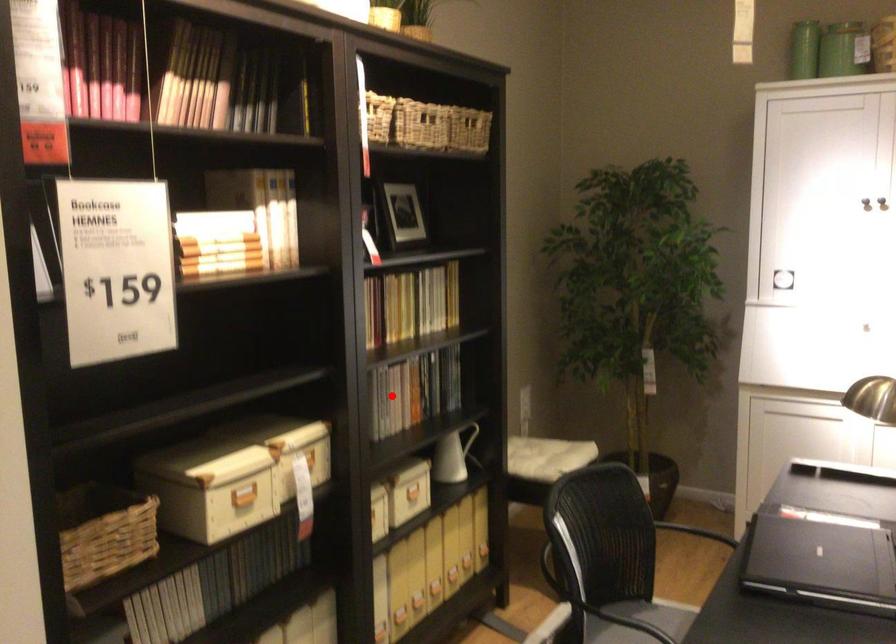
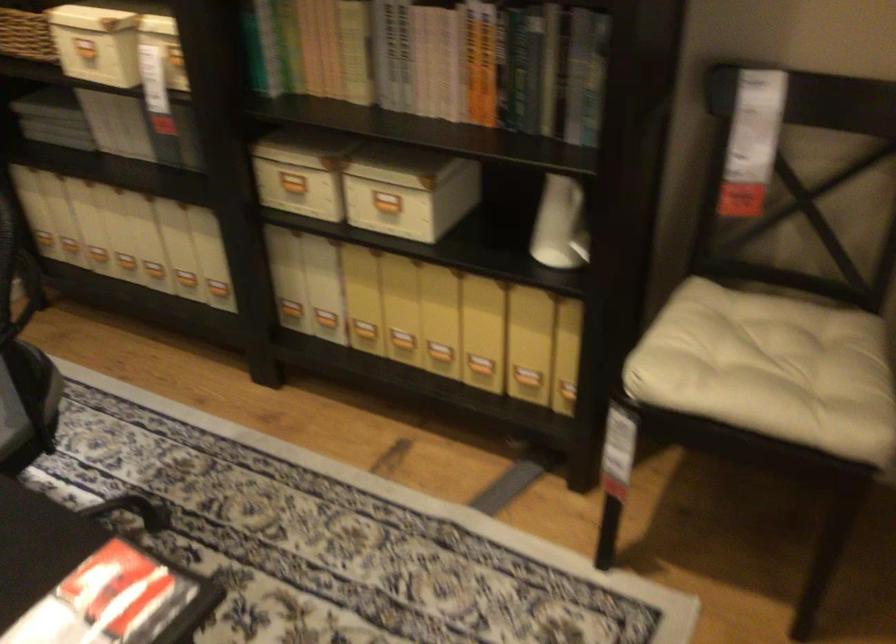
Question: A red point is marked in image1. In image2, is the corresponding 3D point closer to the camera or farther? Reply with the corresponding letter.

Choices:
 (A) The corresponding 3D point is closer.
 (B) The corresponding 3D point is farther.

Answer: (A)